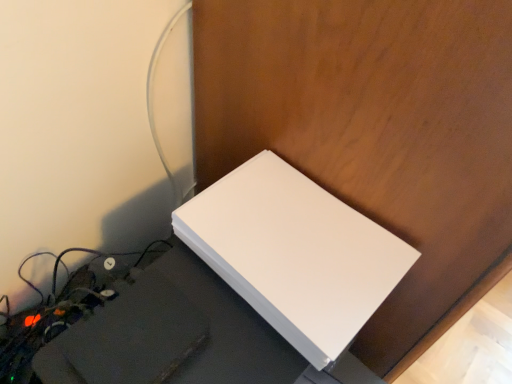
What is the approximate height of white matte computer desk at lower left?

The height of white matte computer desk at lower left is 21.47 centimeters.

Describe the element at coordinates (181, 337) in the screenshot. The width and height of the screenshot is (512, 384). I see `white matte computer desk at lower left` at that location.

This screenshot has height=384, width=512. In order to click on white matte computer desk at lower left in this screenshot , I will do `click(181, 337)`.

Locate an element on the screen. The width and height of the screenshot is (512, 384). white matte wii at center is located at coordinates (294, 253).

What do you see at coordinates (294, 253) in the screenshot?
I see `white matte wii at center` at bounding box center [294, 253].

The height and width of the screenshot is (384, 512). Find the location of `white matte computer desk at lower left`. white matte computer desk at lower left is located at coordinates (181, 337).

Based on their positions, is white matte wii at center located to the left or right of white matte computer desk at lower left?

white matte wii at center is positioned on white matte computer desk at lower left's right side.

Which object is closer to the camera, white matte wii at center or white matte computer desk at lower left?

white matte computer desk at lower left.

Is point (353, 270) more distant than point (115, 335)?

Yes, point (353, 270) is behind point (115, 335).

From the picture: From the image's perspective, which one is positioned lower, white matte wii at center or white matte computer desk at lower left?

white matte computer desk at lower left.

From a real-world perspective, is white matte wii at center below white matte computer desk at lower left?

No, from a real-world perspective, white matte wii at center is not under white matte computer desk at lower left.

Consider the image. Considering the sizes of objects white matte wii at center and white matte computer desk at lower left in the image provided, who is wider, white matte wii at center or white matte computer desk at lower left?

Wider between the two is white matte computer desk at lower left.

Considering the sizes of white matte wii at center and white matte computer desk at lower left in the image, is white matte wii at center taller or shorter than white matte computer desk at lower left?

white matte wii at center is shorter than white matte computer desk at lower left.

Is white matte wii at center bigger than white matte computer desk at lower left?

Incorrect, white matte wii at center is not larger than white matte computer desk at lower left.

Could white matte computer desk at lower left be considered to be inside white matte wii at center?

No, white matte computer desk at lower left is not inside white matte wii at center.

Is white matte wii at center beside white matte computer desk at lower left?

white matte wii at center and white matte computer desk at lower left are clearly separated.

Is white matte wii at center facing towards white matte computer desk at lower left?

No.

Can you tell me how much white matte wii at center and white matte computer desk at lower left differ in facing direction?

The angular difference between white matte wii at center and white matte computer desk at lower left is 1.67 degrees.

In the image, there is a white matte wii at center. Where is `computer desk below it (from the image's perspective)`? computer desk below it (from the image's perspective) is located at coordinates (x=181, y=337).

Would you say white matte computer desk at lower left is to the left or to the right of white matte wii at center in the picture?

Clearly, white matte computer desk at lower left is on the left of white matte wii at center in the image.

Consider the image. Considering the positions of objects white matte computer desk at lower left and white matte wii at center in the image provided, who is behind, white matte computer desk at lower left or white matte wii at center?

white matte wii at center is behind.

Is point (180, 333) closer to viewer compared to point (227, 204)?

Yes, it is.

From the image's perspective, between white matte computer desk at lower left and white matte wii at center, who is located below?

white matte computer desk at lower left, from the image's perspective.

From a real-world perspective, is white matte computer desk at lower left over white matte wii at center?

No, from a real-world perspective, white matte computer desk at lower left is not over white matte wii at center

Is white matte computer desk at lower left wider than white matte wii at center?

Yes.

Which of these two, white matte computer desk at lower left or white matte wii at center, stands shorter?

With less height is white matte wii at center.

Between white matte computer desk at lower left and white matte wii at center, which one has smaller size?

With smaller size is white matte wii at center.

Could white matte wii at center be considered to be inside white matte computer desk at lower left?

No, white matte wii at center is not a part of white matte computer desk at lower left.

Is white matte computer desk at lower left touching white matte wii at center?

No, white matte computer desk at lower left is not next to white matte wii at center.

Could you tell me if white matte computer desk at lower left is turned towards white matte wii at center?

No, white matte computer desk at lower left does not turn towards white matte wii at center.

I want to click on Wii behind the white matte computer desk at lower left, so click(x=294, y=253).

You are a GUI agent. You are given a task and a screenshot of the screen. Output one action in this format:
    pyautogui.click(x=<x>, y=<y>)
    Task: Click on the computer desk that appears on the left of white matte wii at center
    The image size is (512, 384).
    Given the screenshot: What is the action you would take?
    pyautogui.click(x=181, y=337)

Where is `Wii on the right of white matte computer desk at lower left`? The image size is (512, 384). Wii on the right of white matte computer desk at lower left is located at coordinates (294, 253).